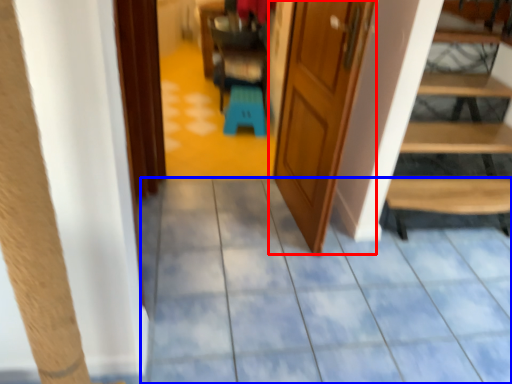
Question: Which of the following is the farthest to the observer, door (highlighted by a red box) or path (highlighted by a blue box)?

Choices:
 (A) door
 (B) path

Answer: (A)